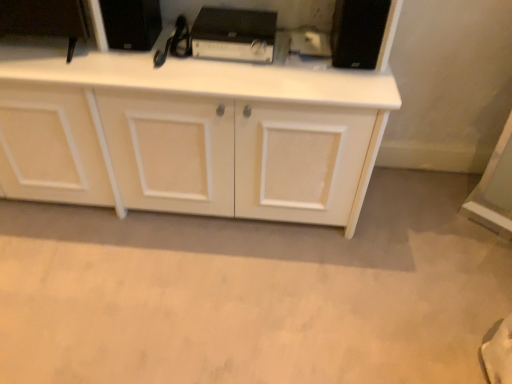
What do you see at coordinates (131, 23) in the screenshot? I see `black matte speaker at upper center, positioned as the 1th appliance in left-to-right order` at bounding box center [131, 23].

Find the location of a particular element. The height and width of the screenshot is (384, 512). white matte cabinet at center is located at coordinates (192, 131).

This screenshot has width=512, height=384. Describe the element at coordinates (234, 35) in the screenshot. I see `black plastic amplifier at center, arranged as the second appliance when viewed from the right` at that location.

Where is `black matte speaker at upper center, positioned as the 1th appliance in left-to-right order`? The width and height of the screenshot is (512, 384). black matte speaker at upper center, positioned as the 1th appliance in left-to-right order is located at coordinates (131, 23).

From the image's perspective, is black matte speaker at upper center, which ranks as the third appliance in right-to-left order, on top of black plastic amplifier at center, arranged as the second appliance when viewed from the right?

Yes.

Could black plastic amplifier at center, arranged as the second appliance when viewed from the right, be considered to be inside black matte speaker at upper center, which ranks as the third appliance in right-to-left order?

No, black plastic amplifier at center, arranged as the second appliance when viewed from the right, is not inside black matte speaker at upper center, which ranks as the third appliance in right-to-left order.

Between black matte speaker at upper center, which ranks as the third appliance in right-to-left order, and black plastic amplifier at center, which ranks as the 2th appliance in left-to-right order, which one is positioned in front?

black matte speaker at upper center, which ranks as the third appliance in right-to-left order, is closer to the camera.

Are white matte cabinet at center and black matte speaker at upper center, which ranks as the third appliance in right-to-left order, making contact?

No, white matte cabinet at center is not next to black matte speaker at upper center, which ranks as the third appliance in right-to-left order.

Considering the sizes of objects white matte cabinet at center and black matte speaker at upper center, which ranks as the third appliance in right-to-left order, in the image provided, who is thinner, white matte cabinet at center or black matte speaker at upper center, which ranks as the third appliance in right-to-left order,?

Thinner between the two is black matte speaker at upper center, which ranks as the third appliance in right-to-left order.

How different are the orientations of white matte cabinet at center and black matte speaker at upper center, which ranks as the third appliance in right-to-left order, in degrees?

white matte cabinet at center and black matte speaker at upper center, which ranks as the third appliance in right-to-left order, are facing 0.00392 degrees away from each other.

From the image's perspective, is white matte cabinet at center above or below black matte speaker at upper center, which ranks as the third appliance in right-to-left order?

Clearly, from the image's perspective, white matte cabinet at center is below black matte speaker at upper center, which ranks as the third appliance in right-to-left order.

What's the angular difference between white matte cabinet at center and black plastic amplifier at center, which ranks as the 2th appliance in left-to-right order,'s facing directions?

1.78 degrees separate the facing orientations of white matte cabinet at center and black plastic amplifier at center, which ranks as the 2th appliance in left-to-right order.

Which is nearer, (289, 134) or (263, 22)?

Point (289, 134)

Is white matte cabinet at center not inside black plastic amplifier at center, arranged as the second appliance when viewed from the right?

white matte cabinet at center lies outside black plastic amplifier at center, arranged as the second appliance when viewed from the right,'s area.

Locate an element on the screen. The width and height of the screenshot is (512, 384). cabinetry that appears below the black plastic amplifier at center, arranged as the second appliance when viewed from the right (from a real-world perspective) is located at coordinates (192, 131).

How different are the orientations of black matte speaker at upper right, the third appliance in the left-to-right sequence, and white matte cabinet at center in degrees?

1.78 degrees.

From the image's perspective, is black matte speaker at upper right, the third appliance in the left-to-right sequence, above white matte cabinet at center?

Yes, from the image's perspective, black matte speaker at upper right, the third appliance in the left-to-right sequence, is on top of white matte cabinet at center.

Between black matte speaker at upper right, the third appliance in the left-to-right sequence, and white matte cabinet at center, which one appears on the right side from the viewer's perspective?

black matte speaker at upper right, the third appliance in the left-to-right sequence, is more to the right.

Is black matte speaker at upper right, positioned as the 1th appliance in right-to-left order, further to camera compared to white matte cabinet at center?

Yes, it is.

From a real-world perspective, between black plastic amplifier at center, which ranks as the 2th appliance in left-to-right order, and black matte speaker at upper center, positioned as the 1th appliance in left-to-right order, who is vertically lower?

In real-world perspective, black plastic amplifier at center, which ranks as the 2th appliance in left-to-right order, is lower.

Is black plastic amplifier at center, which ranks as the 2th appliance in left-to-right order, looking in the opposite direction of black matte speaker at upper center, positioned as the 1th appliance in left-to-right order?

No, black plastic amplifier at center, which ranks as the 2th appliance in left-to-right order, is not facing away from black matte speaker at upper center, positioned as the 1th appliance in left-to-right order.

Can we say black plastic amplifier at center, which ranks as the 2th appliance in left-to-right order, lies outside black matte speaker at upper center, which ranks as the third appliance in right-to-left order?

black plastic amplifier at center, which ranks as the 2th appliance in left-to-right order, is positioned outside black matte speaker at upper center, which ranks as the third appliance in right-to-left order.

Can you tell me how much black plastic amplifier at center, which ranks as the 2th appliance in left-to-right order, and black matte speaker at upper center, positioned as the 1th appliance in left-to-right order, differ in facing direction?

The angle between the facing direction of black plastic amplifier at center, which ranks as the 2th appliance in left-to-right order, and the facing direction of black matte speaker at upper center, positioned as the 1th appliance in left-to-right order, is 1.79 degrees.

Considering the sizes of objects black plastic amplifier at center, which ranks as the 2th appliance in left-to-right order, and black matte speaker at upper right, the third appliance in the left-to-right sequence, in the image provided, who is wider, black plastic amplifier at center, which ranks as the 2th appliance in left-to-right order, or black matte speaker at upper right, the third appliance in the left-to-right sequence,?

black plastic amplifier at center, which ranks as the 2th appliance in left-to-right order.

Find the location of a particular element. The width and height of the screenshot is (512, 384). the 2nd appliance located above the black plastic amplifier at center, which ranks as the 2th appliance in left-to-right order (from a real-world perspective) is located at coordinates (358, 32).

Is black plastic amplifier at center, which ranks as the 2th appliance in left-to-right order, aimed at black matte speaker at upper right, positioned as the 1th appliance in right-to-left order?

No, black plastic amplifier at center, which ranks as the 2th appliance in left-to-right order, is not turned towards black matte speaker at upper right, positioned as the 1th appliance in right-to-left order.

Image resolution: width=512 pixels, height=384 pixels. There is a black matte speaker at upper right, positioned as the 1th appliance in right-to-left order. In order to click on the 1st appliance above it (from the image's perspective) in this screenshot , I will do `click(234, 35)`.

Is point (339, 67) positioned behind point (243, 43)?

Yes, point (339, 67) is farther from viewer.

Considering the sizes of objects black matte speaker at upper right, the third appliance in the left-to-right sequence, and black plastic amplifier at center, which ranks as the 2th appliance in left-to-right order, in the image provided, who is bigger, black matte speaker at upper right, the third appliance in the left-to-right sequence, or black plastic amplifier at center, which ranks as the 2th appliance in left-to-right order,?

black plastic amplifier at center, which ranks as the 2th appliance in left-to-right order.

Is black matte speaker at upper right, the third appliance in the left-to-right sequence, facing away from black plastic amplifier at center, arranged as the second appliance when viewed from the right?

That's not correct — black matte speaker at upper right, the third appliance in the left-to-right sequence, is not looking away from black plastic amplifier at center, arranged as the second appliance when viewed from the right.

From the black plastic amplifier at center, arranged as the second appliance when viewed from the right, count 1st appliances forward and point to it. Please provide its 2D coordinates.

[(131, 23)]

Where is `cabinetry on the left of black matte speaker at upper center, which ranks as the third appliance in right-to-left order`? The height and width of the screenshot is (384, 512). cabinetry on the left of black matte speaker at upper center, which ranks as the third appliance in right-to-left order is located at coordinates (192, 131).

Looking at the image, which one is located further to white matte cabinet at center, black matte speaker at upper right, the third appliance in the left-to-right sequence, or black plastic amplifier at center, which ranks as the 2th appliance in left-to-right order?

Result: The object further to white matte cabinet at center is black matte speaker at upper right, the third appliance in the left-to-right sequence.

Considering their positions, is black matte speaker at upper center, positioned as the 1th appliance in left-to-right order, positioned further to black matte speaker at upper right, positioned as the 1th appliance in right-to-left order, than black plastic amplifier at center, arranged as the second appliance when viewed from the right?

black matte speaker at upper center, positioned as the 1th appliance in left-to-right order, is further to black matte speaker at upper right, positioned as the 1th appliance in right-to-left order.

From the image, which object appears to be nearer to white matte cabinet at center, black plastic amplifier at center, arranged as the second appliance when viewed from the right, or black matte speaker at upper center, positioned as the 1th appliance in left-to-right order?

Among the two, black plastic amplifier at center, arranged as the second appliance when viewed from the right, is located nearer to white matte cabinet at center.

Considering their positions, is black matte speaker at upper center, positioned as the 1th appliance in left-to-right order, positioned closer to white matte cabinet at center than black matte speaker at upper right, the third appliance in the left-to-right sequence?

Among the two, black matte speaker at upper center, positioned as the 1th appliance in left-to-right order, is located nearer to white matte cabinet at center.

Consider the image. Considering their positions, is black matte speaker at upper center, which ranks as the third appliance in right-to-left order, positioned further to black plastic amplifier at center, which ranks as the 2th appliance in left-to-right order, than black matte speaker at upper right, the third appliance in the left-to-right sequence?

Among the two, black matte speaker at upper right, the third appliance in the left-to-right sequence, is located further to black plastic amplifier at center, which ranks as the 2th appliance in left-to-right order.

From the image, which object appears to be nearer to black plastic amplifier at center, arranged as the second appliance when viewed from the right, black matte speaker at upper right, positioned as the 1th appliance in right-to-left order, or white matte cabinet at center?

black matte speaker at upper right, positioned as the 1th appliance in right-to-left order.

Estimate the real-world distances between objects in this image. Which object is closer to black plastic amplifier at center, which ranks as the 2th appliance in left-to-right order, white matte cabinet at center or black matte speaker at upper right, positioned as the 1th appliance in right-to-left order?

black matte speaker at upper right, positioned as the 1th appliance in right-to-left order, lies closer to black plastic amplifier at center, which ranks as the 2th appliance in left-to-right order, than the other object.

Considering their positions, is black plastic amplifier at center, arranged as the second appliance when viewed from the right, positioned further to black matte speaker at upper center, positioned as the 1th appliance in left-to-right order, than black matte speaker at upper right, the third appliance in the left-to-right sequence?

black matte speaker at upper right, the third appliance in the left-to-right sequence, lies further to black matte speaker at upper center, positioned as the 1th appliance in left-to-right order, than the other object.

The width and height of the screenshot is (512, 384). I want to click on appliance between white matte cabinet at center and black plastic amplifier at center, arranged as the second appliance when viewed from the right, so click(131, 23).

Identify the location of appliance between black matte speaker at upper center, positioned as the 1th appliance in left-to-right order, and black matte speaker at upper right, positioned as the 1th appliance in right-to-left order. (234, 35).